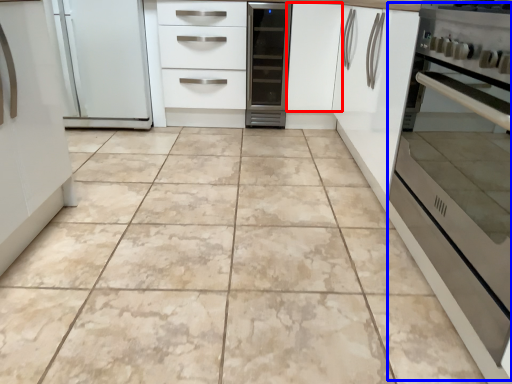
Question: Which object is further to the camera taking this photo, cabinetry (highlighted by a red box) or oven (highlighted by a blue box)?

Choices:
 (A) cabinetry
 (B) oven

Answer: (A)